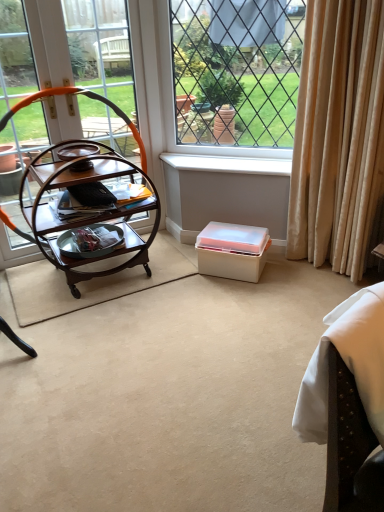
Where is `free space above white plastic window sill at center (from a real-world perspective)`? The width and height of the screenshot is (384, 512). free space above white plastic window sill at center (from a real-world perspective) is located at coordinates (231, 158).